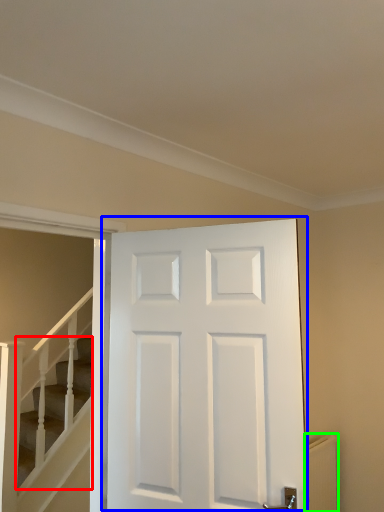
Question: Which is nearer to the stairs (highlighted by a red box)? door (highlighted by a blue box) or radiator (highlighted by a green box).

Choices:
 (A) door
 (B) radiator

Answer: (A)